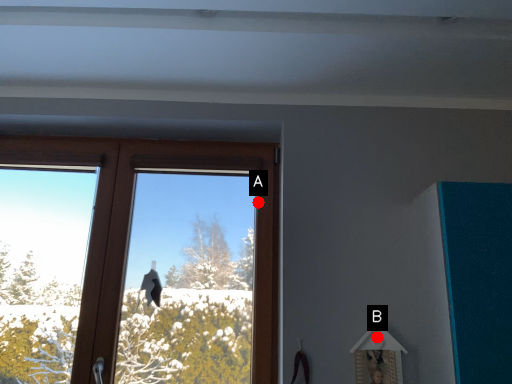
Question: Two points are circled on the image, labeled by A and B beside each circle. Which point is farther from the camera taking this photo?

Choices:
 (A) A is further
 (B) B is further

Answer: (A)